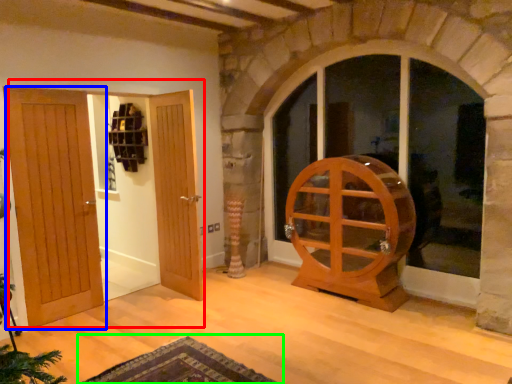
Question: Which object is positioned farthest from door (highlighted by a red box)? Select from door (highlighted by a blue box) and doormat (highlighted by a green box).

Choices:
 (A) door
 (B) doormat

Answer: (B)